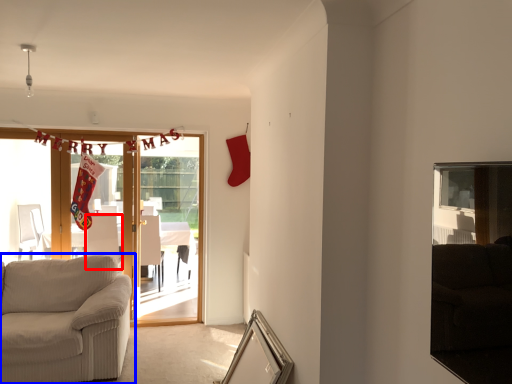
Question: Which object appears farthest to the camera in this image, armchair (highlighted by a red box) or studio couch (highlighted by a blue box)?

Choices:
 (A) armchair
 (B) studio couch

Answer: (A)